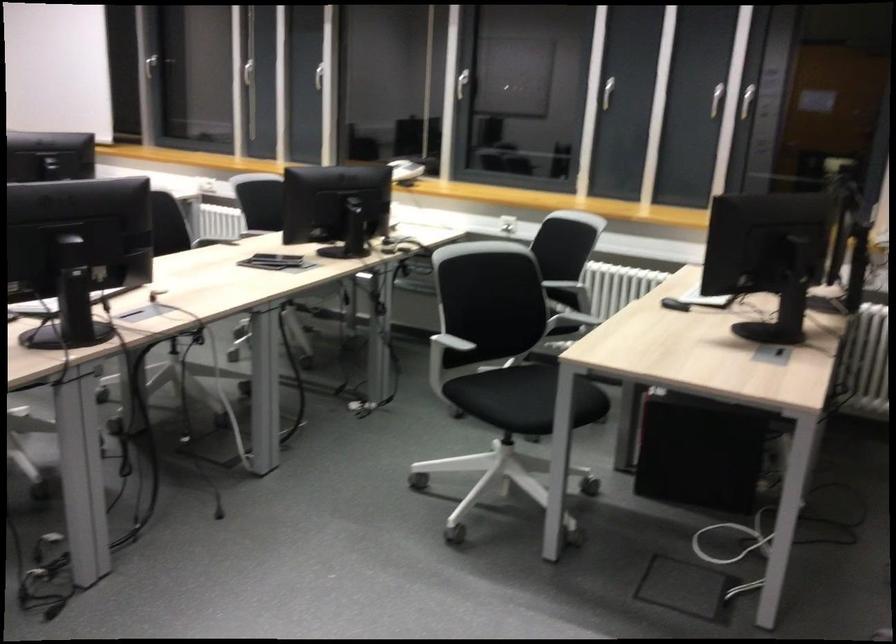
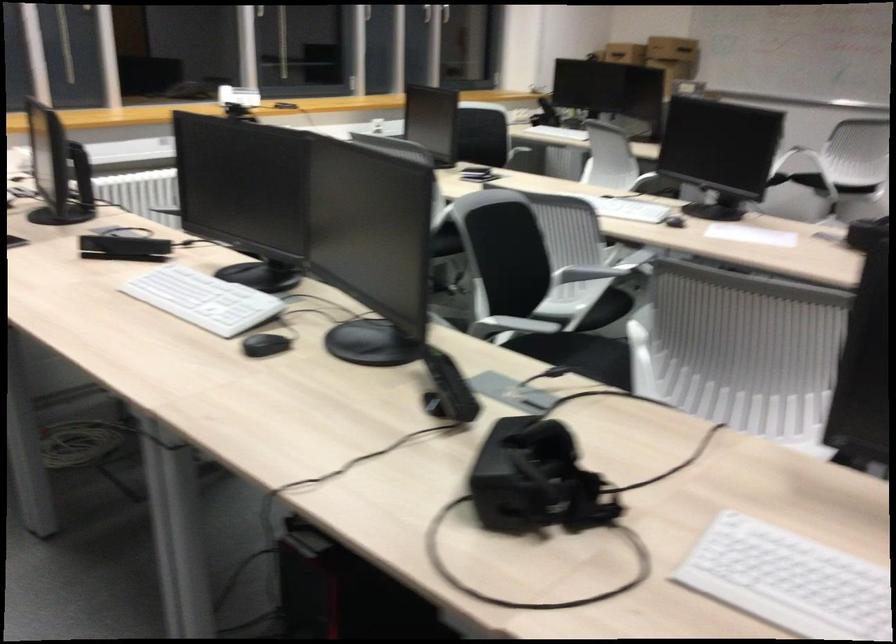
Where in the second image is the point corresponding to (x=446, y=158) from the first image?

(238, 96)